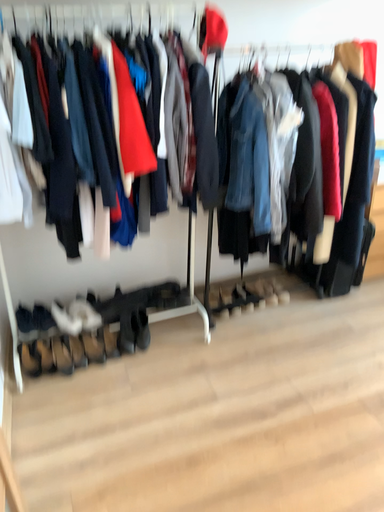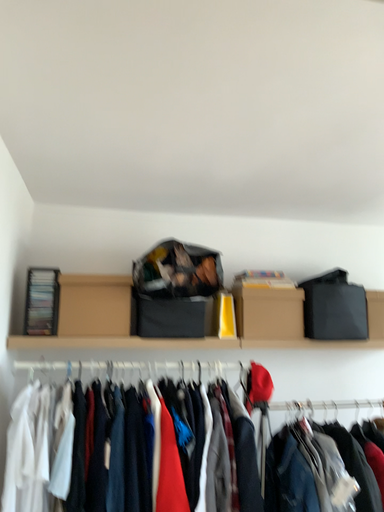
Question: How did the camera likely rotate when shooting the video?

Choices:
 (A) rotated upward
 (B) rotated downward

Answer: (A)